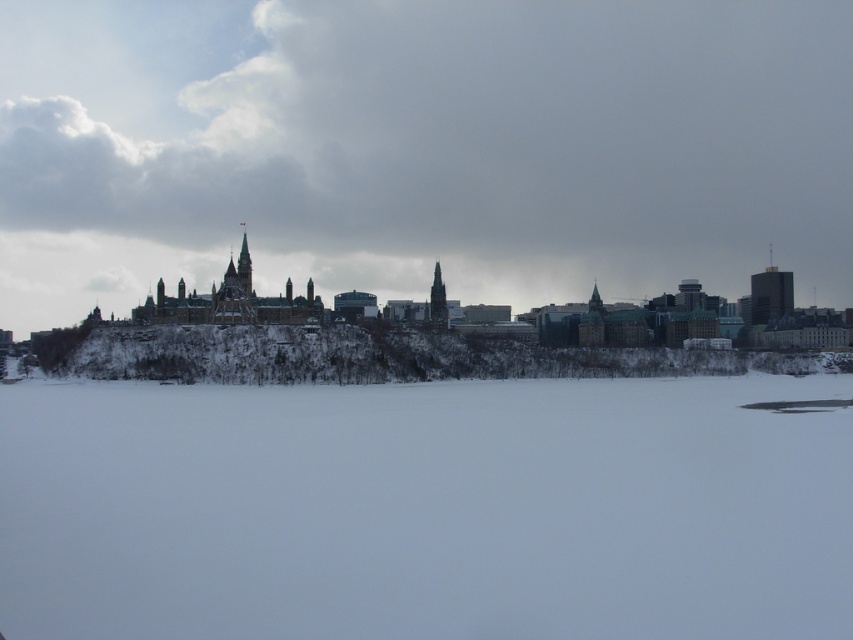
Is white powdery snow at center above snowy rocky hill at lower center?

Actually, white powdery snow at center is below snowy rocky hill at lower center.

Is point (297, 422) farther from viewer compared to point (140, 328)?

No, it is not.

Where is `white powdery snow at center`? The height and width of the screenshot is (640, 853). white powdery snow at center is located at coordinates (426, 509).

Between white fluffy cloud at upper center and white powdery snow at center, which one is positioned higher?

white fluffy cloud at upper center

Locate an element on the screen. white fluffy cloud at upper center is located at coordinates (422, 145).

Consider the image. Who is lower down, white fluffy cloud at upper center or snowy rocky hill at lower center?

snowy rocky hill at lower center is below.

Which is behind, point (280, 161) or point (270, 332)?

The point (280, 161) is more distant.

Find the location of a particular element. Image resolution: width=853 pixels, height=640 pixels. white fluffy cloud at upper center is located at coordinates (422, 145).

Find the location of a particular element. white fluffy cloud at upper center is located at coordinates (422, 145).